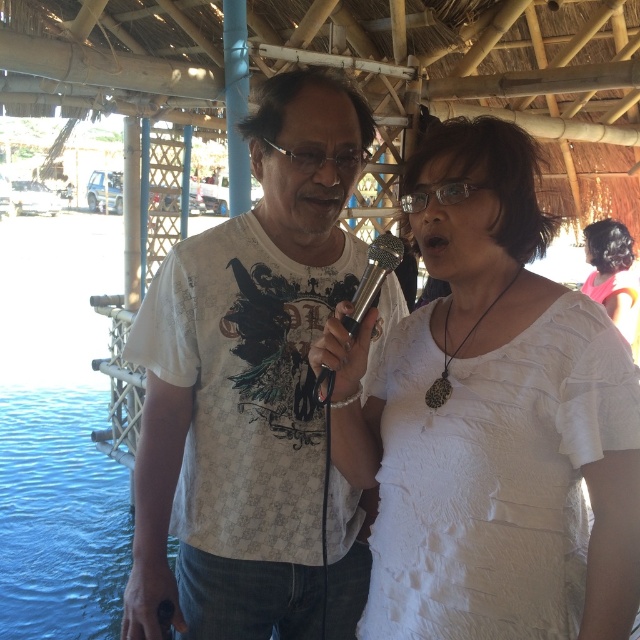
You are standing at point (307, 310) and want to walk to point (547, 355). Which direction should you move to get closer to your destination?

To move from point (307, 310) to point (547, 355), you should move upwards and to the right because point (547, 355) is closer to the viewer than point (307, 310), indicating it is positioned higher in the scene.

You are a photographer trying to capture a clear shot of both the dark brown hair at right and the silver metallic microphone at center. Which object should you focus on first if you want to ensure both are in focus, considering their sizes?

The dark brown hair at right is larger in size than the silver metallic microphone at center, so you should focus on the dark brown hair at right first to ensure both are in focus.